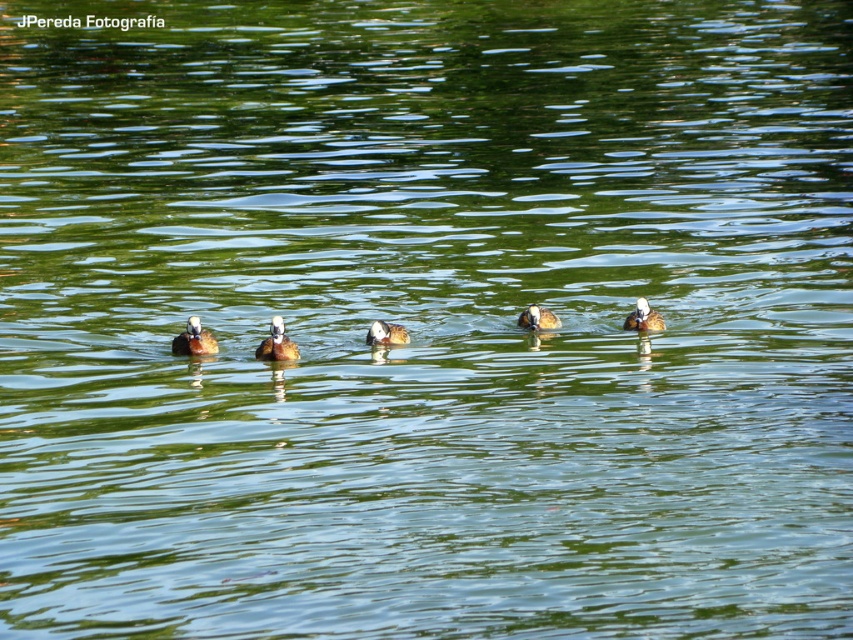
Question: Can you confirm if white fluffy duck at right is smaller than brown fuzzy duck at center?

Choices:
 (A) no
 (B) yes

Answer: (A)

Question: In this image, where is brown fuzzy duckling at center located relative to brown fuzzy duck at center?

Choices:
 (A) left
 (B) right

Answer: (A)

Question: Which object appears closest to the camera in this image?

Choices:
 (A) brown fuzzy duck at center
 (B) brown matte duck at center
 (C) white fluffy duck at right
 (D) brown glossy duck at center

Answer: (B)

Question: Among these points, which one is farthest from the camera?

Choices:
 (A) (193, 342)
 (B) (392, 330)
 (C) (282, 332)
 (D) (538, 312)

Answer: (D)

Question: Considering the real-world distances, which object is farthest from the brown fuzzy duckling at center?

Choices:
 (A) brown glossy duck at center
 (B) white fluffy duck at right

Answer: (B)

Question: Does brown matte duck at center appear on the right side of white fluffy duck at right?

Choices:
 (A) no
 (B) yes

Answer: (A)